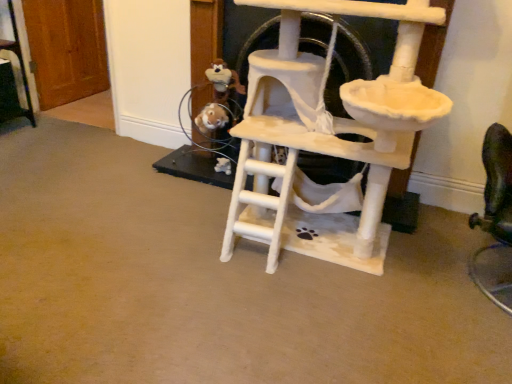
I want to click on vacant area situated below white fabric cat tree at center (from a real-world perspective), so click(307, 264).